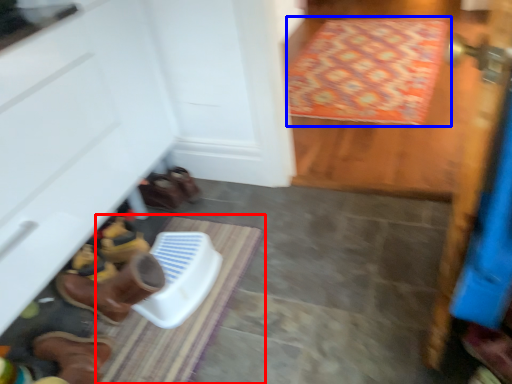
Question: Among these objects, which one is nearest to the camera, doormat (highlighted by a red box) or doormat (highlighted by a blue box)?

Choices:
 (A) doormat
 (B) doormat

Answer: (A)